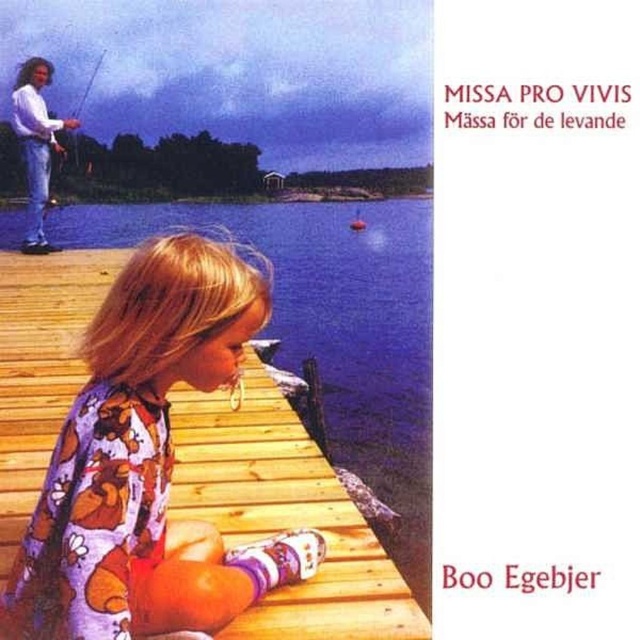
Consider the image. You are a photographer taking a picture of the scene. You notice a white matte shirt at upper left located at point (x=36, y=145). Where should you position your camera to ensure the white matte shirt at upper left is in the center of the frame?

To center the white matte shirt at upper left located at point (x=36, y=145), position your camera so that the point (x=36, y=145) is aligned with the frame center.

You are a photographer taking a picture of the purple printed dress at center and the white matte shirt at upper left. Which object will appear closer to the camera in the final photo?

The purple printed dress at center will appear closer to the camera in the final photo because it is in front of the white matte shirt at upper left.

Please describe the location of the purple printed dress at center in the image using coordinates. The coordinate system has the origin at the bottom left corner of the image, with the x and y axes increasing to the right and up respectively. The maximum x and y values are both 1.0. Please provide the coordinates as a tuple of two decimal numbers rounded to three decimal places.

The purple printed dress at center is located at coordinates approximately at point 0.725 in x and 0.230 in y.